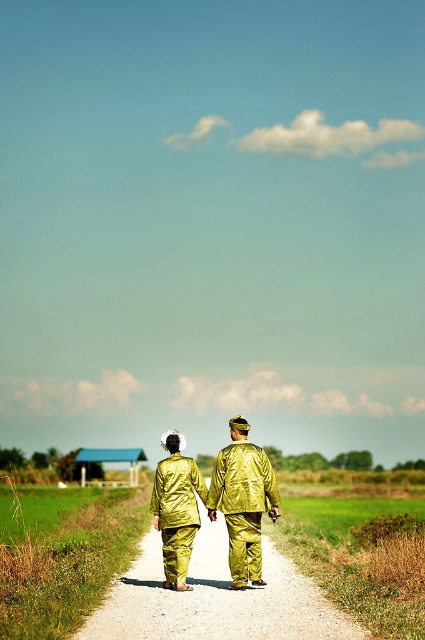
Question: Observing the image, what is the correct spatial positioning of gold shiny pants at center in reference to shiny gold suit at center?

Choices:
 (A) left
 (B) right

Answer: (A)

Question: Does shiny gold suit at center have a lesser width compared to shiny gold trench coat at center?

Choices:
 (A) no
 (B) yes

Answer: (A)

Question: Which object is farther from the camera taking this photo?

Choices:
 (A) gold shiny pants at center
 (B) shiny gold suit at center

Answer: (B)

Question: Which point is closer to the camera taking this photo?

Choices:
 (A) (161, 534)
 (B) (244, 536)

Answer: (B)

Question: Which object is closer to the camera taking this photo?

Choices:
 (A) gold shiny pants at center
 (B) shiny gold suit at center

Answer: (A)

Question: Does gold shiny pants at center have a smaller size compared to shiny gold suit at center?

Choices:
 (A) no
 (B) yes

Answer: (A)